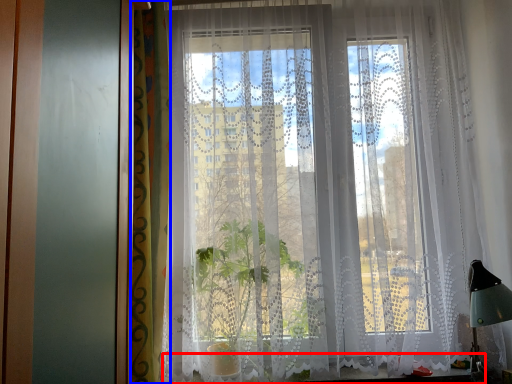
Question: Which object is closer to the camera taking this photo, window sill (highlighted by a red box) or curtain (highlighted by a blue box)?

Choices:
 (A) window sill
 (B) curtain

Answer: (B)